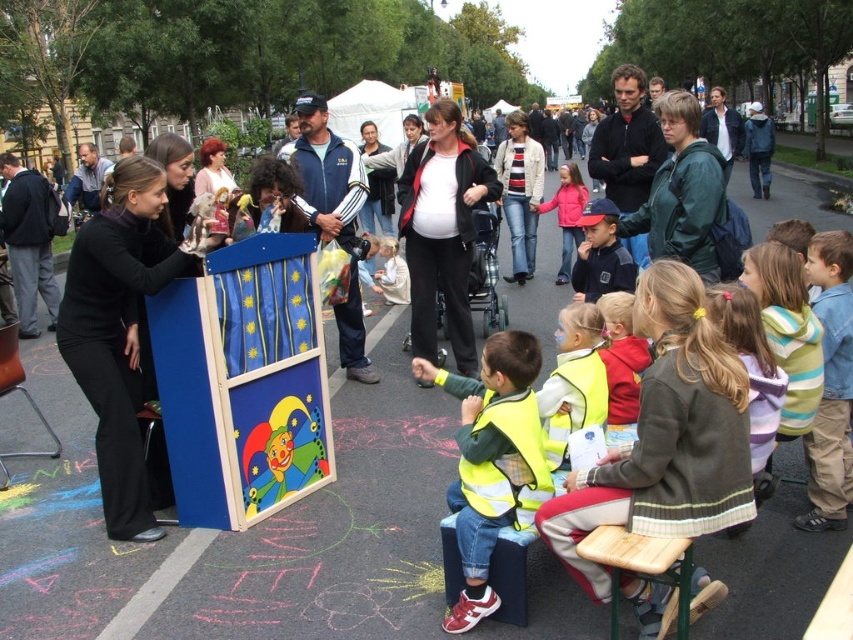
Question: Which object appears farthest from the camera in this image?

Choices:
 (A) yellow high-visibility vest at center
 (B) blue painted wooden podium at center
 (C) hi-viz yellow vest at center
 (D) blue fabric cap at center

Answer: (B)

Question: Which object is positioned closest to the yellow high-visibility vest at center?

Choices:
 (A) wooden puppet show at center
 (B) blue painted wooden podium at center
 (C) hi-viz yellow vest at center

Answer: (C)

Question: Does yellow high-visibility vest at center have a lesser width compared to hi-viz yellow vest at center?

Choices:
 (A) no
 (B) yes

Answer: (A)

Question: Can you confirm if yellow high-visibility vest at center is thinner than blue fabric cap at center?

Choices:
 (A) no
 (B) yes

Answer: (A)

Question: Can you confirm if wooden puppet show at center is positioned to the left of blue fabric cap at center?

Choices:
 (A) yes
 (B) no

Answer: (A)

Question: Which object is the closest to the blue painted wooden podium at center?

Choices:
 (A) blue fabric cap at center
 (B) hi-viz yellow vest at center
 (C) yellow high-visibility vest at center
 (D) wooden puppet show at center

Answer: (A)